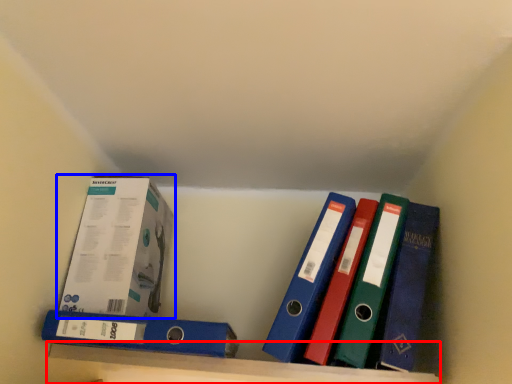
Question: Which object appears farthest to the camera in this image, shelf (highlighted by a red box) or box (highlighted by a blue box)?

Choices:
 (A) shelf
 (B) box

Answer: (B)